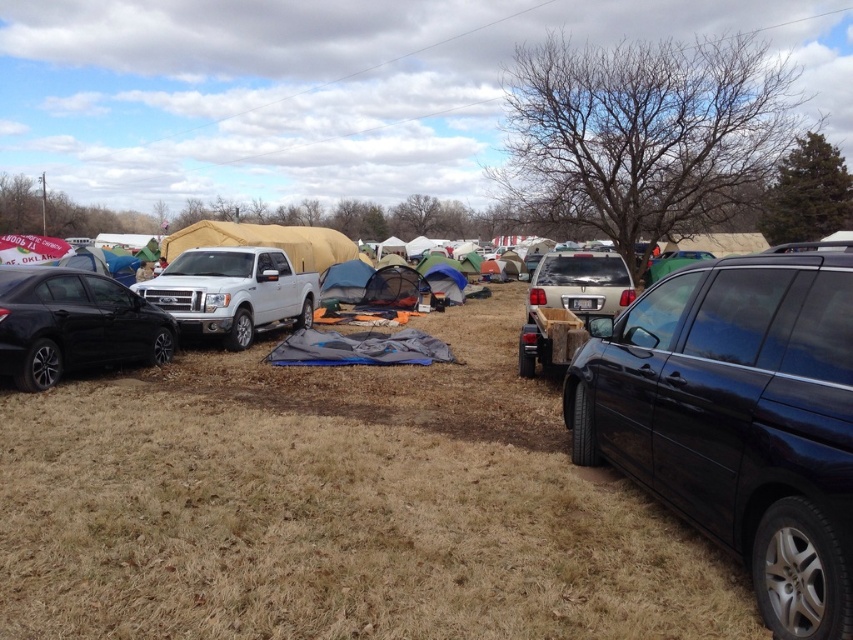
Question: Estimate the real-world distances between objects in this image. Which object is farther from the brown grassy field at center?

Choices:
 (A) white matte truck at center
 (B) shiny black sedan at left

Answer: (A)

Question: Does shiny black sedan at left have a smaller size compared to white matte truck at center?

Choices:
 (A) yes
 (B) no

Answer: (A)

Question: Does shiny black sedan at left appear under white matte truck at center?

Choices:
 (A) yes
 (B) no

Answer: (A)

Question: Which object is farther from the camera taking this photo?

Choices:
 (A) white matte truck at center
 (B) black matte minivan at right
 (C) shiny black sedan at left
 (D) brown grassy field at center

Answer: (A)

Question: In this image, where is shiny black sedan at left located relative to white matte truck at center?

Choices:
 (A) right
 (B) left

Answer: (B)

Question: Which is nearer to the brown grassy field at center?

Choices:
 (A) black matte minivan at right
 (B) white matte truck at center
 (C) shiny black sedan at left

Answer: (A)